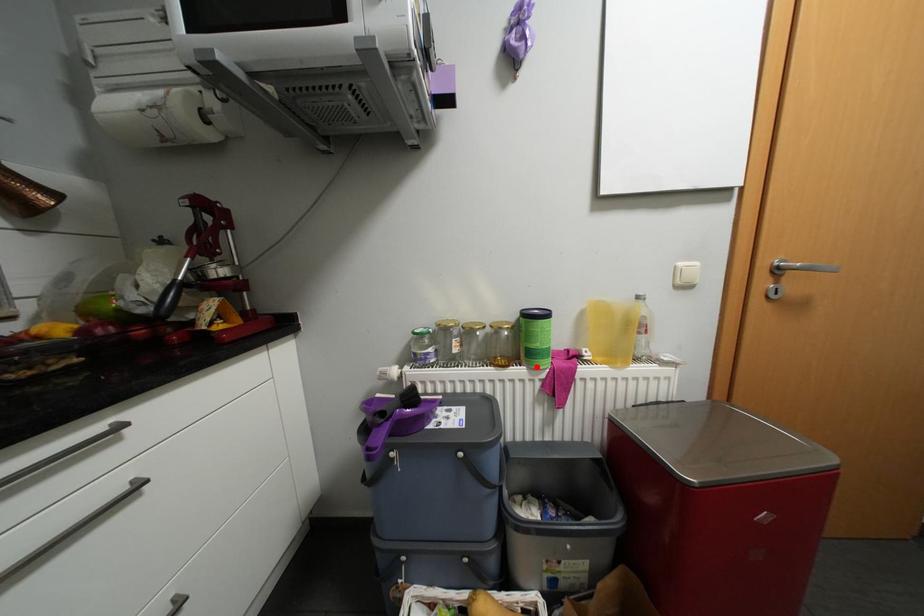
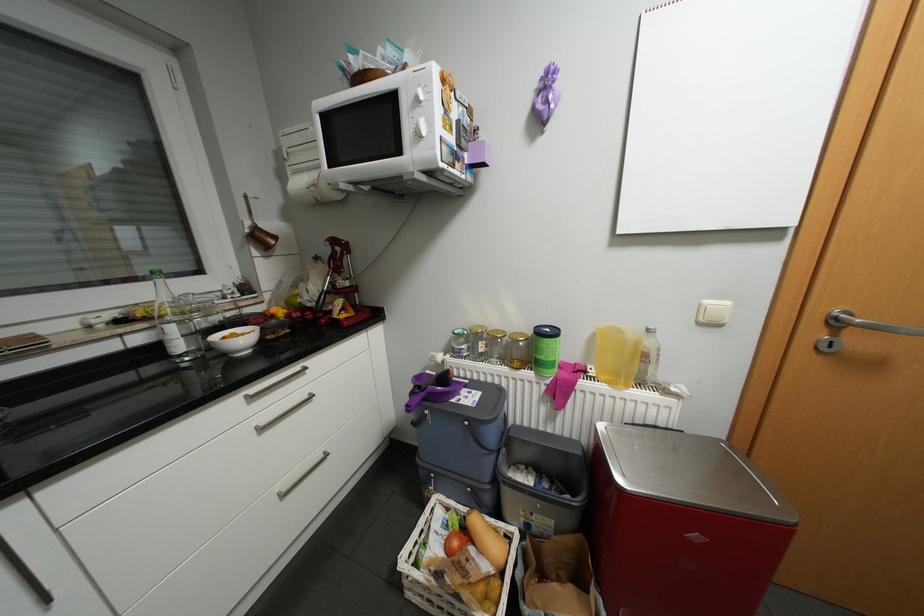
Find the pixel in the second image that matches the highlighted location in the first image.

(544, 373)